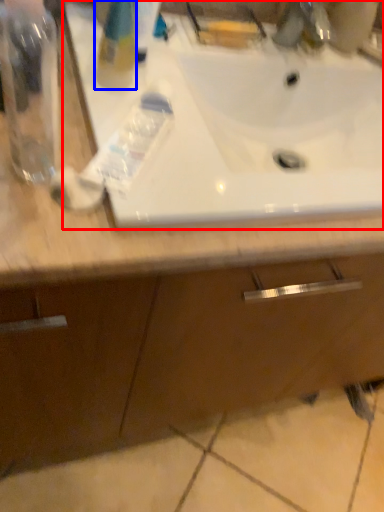
Question: Which object appears farthest to the camera in this image, sink (highlighted by a red box) or cleaning product (highlighted by a blue box)?

Choices:
 (A) sink
 (B) cleaning product

Answer: (B)